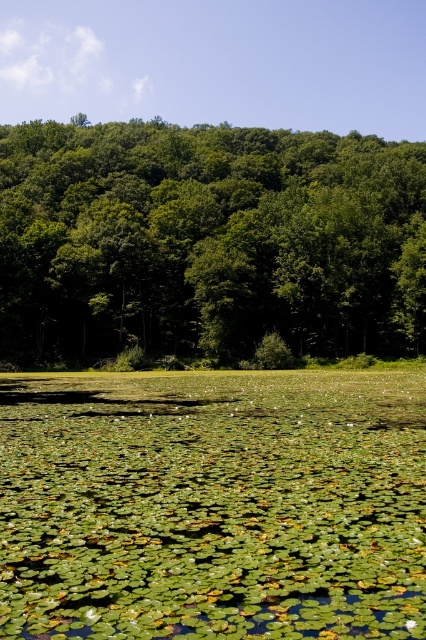
Based on the photo, is green leafy water at center to the left of green leafy trees at upper center from the viewer's perspective?

Incorrect, green leafy water at center is not on the left side of green leafy trees at upper center.

Who is more forward, (210, 444) or (226, 348)?

Point (210, 444) is in front.

Describe the element at coordinates (213, 506) in the screenshot. I see `green leafy water at center` at that location.

Locate an element on the screen. The height and width of the screenshot is (640, 426). green leafy water at center is located at coordinates (213, 506).